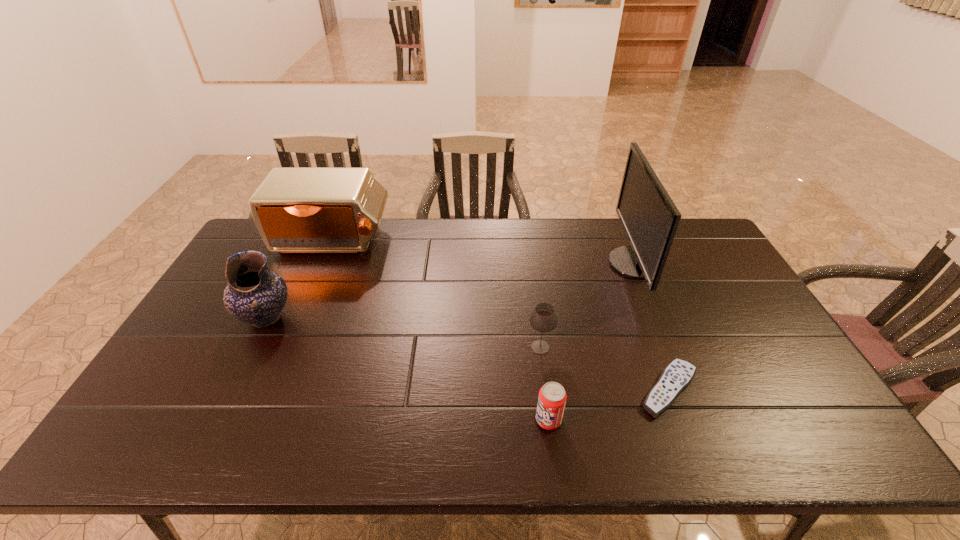
Locate an element on the screen. The image size is (960, 540). pottery at the left edge is located at coordinates (255, 295).

Image resolution: width=960 pixels, height=540 pixels. Identify the location of object that is at the far left corner. (296, 210).

Locate an element on the screen. vacant space at the far edge is located at coordinates (473, 219).

This screenshot has height=540, width=960. I want to click on free region at the near edge of the desktop, so click(369, 448).

What are the coordinates of `vacant space at the left edge of the desktop` in the screenshot? It's located at (158, 392).

I want to click on free space at the right edge of the desktop, so click(x=716, y=338).

Locate an element on the screen. free spot between the fifth tallest object and the toaster oven is located at coordinates (441, 331).

Locate an element on the screen. The height and width of the screenshot is (540, 960). free area in between the fifth tallest object and the monitor is located at coordinates (591, 342).

You are a GUI agent. You are given a task and a screenshot of the screen. Output one action in this format:
    pyautogui.click(x=<x>, y=<y>)
    Task: Click on the vacant area that lies between the pottery and the second shortest object
    The width and height of the screenshot is (960, 540).
    Given the screenshot: What is the action you would take?
    pyautogui.click(x=407, y=369)

The width and height of the screenshot is (960, 540). Find the location of `unoccupied position between the soda can and the pottery`. unoccupied position between the soda can and the pottery is located at coordinates (407, 369).